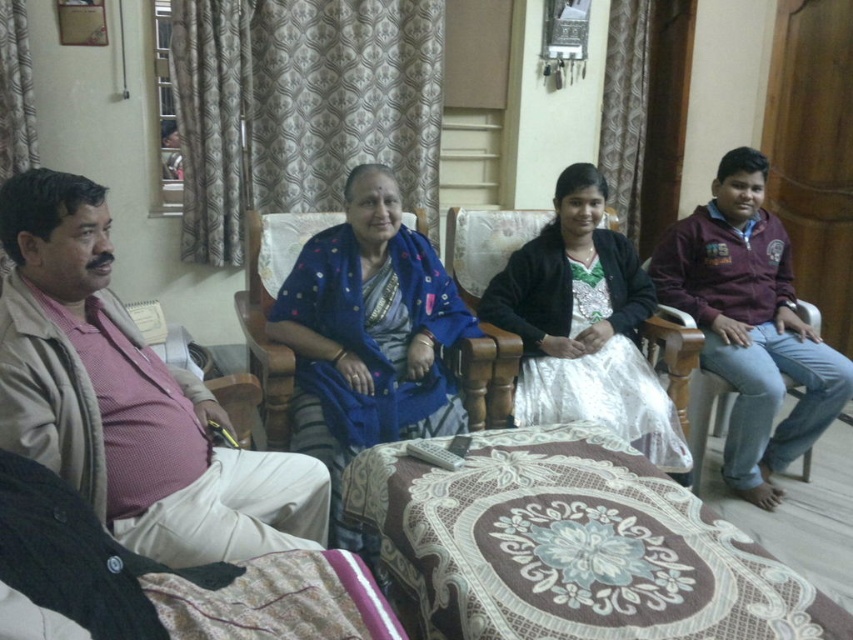
Does blue silk saree at center appear over matte brown wood armchair at right?

Correct, blue silk saree at center is located above matte brown wood armchair at right.

Which of these two, blue silk saree at center or matte brown wood armchair at right, stands taller?

blue silk saree at center is taller.

This screenshot has width=853, height=640. Find the location of `blue silk saree at center`. blue silk saree at center is located at coordinates (368, 339).

Locate an element on the screen. This screenshot has width=853, height=640. blue silk saree at center is located at coordinates (368, 339).

You are a GUI agent. You are given a task and a screenshot of the screen. Output one action in this format:
    pyautogui.click(x=<x>, y=<y>)
    Task: Click on the silvery satin dress at center
    The image size is (853, 640).
    Given the screenshot: What is the action you would take?
    pyautogui.click(x=584, y=324)

Consider the image. Does silvery satin dress at center have a lesser width compared to matte brown wood armchair at right?

No.

Find the location of a particular element. The width and height of the screenshot is (853, 640). silvery satin dress at center is located at coordinates (584, 324).

Is blue silk saree at center above silvery satin dress at center?

Incorrect, blue silk saree at center is not positioned above silvery satin dress at center.

Which is above, blue silk saree at center or silvery satin dress at center?

Positioned higher is silvery satin dress at center.

You are a GUI agent. You are given a task and a screenshot of the screen. Output one action in this format:
    pyautogui.click(x=<x>, y=<y>)
    Task: Click on the blue silk saree at center
    The height and width of the screenshot is (640, 853).
    Given the screenshot: What is the action you would take?
    pyautogui.click(x=368, y=339)

You are a GUI agent. You are given a task and a screenshot of the screen. Output one action in this format:
    pyautogui.click(x=<x>, y=<y>)
    Task: Click on the blue silk saree at center
    This screenshot has width=853, height=640.
    Given the screenshot: What is the action you would take?
    pyautogui.click(x=368, y=339)